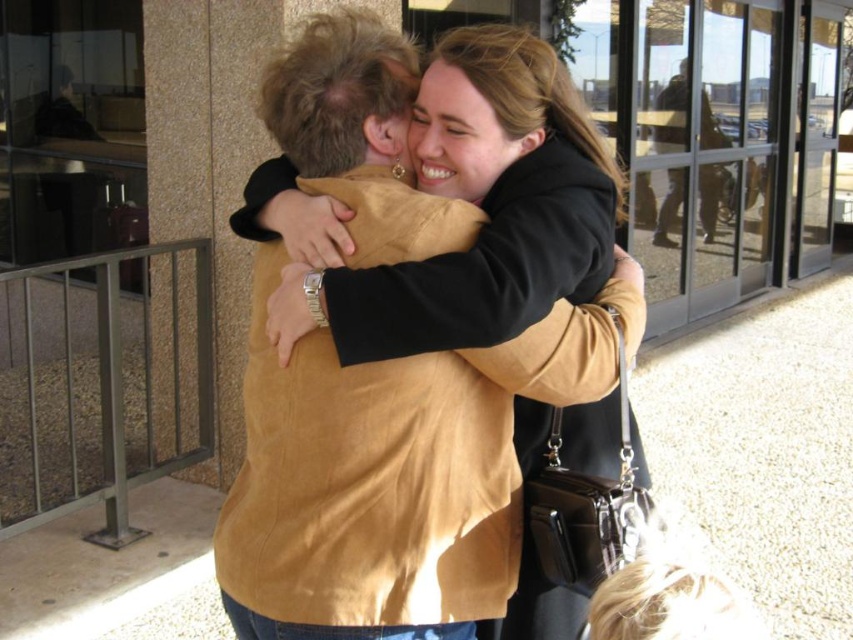
Is matte brown jacket at center shorter than brown suede jacket at upper right?

Correct, matte brown jacket at center is not as tall as brown suede jacket at upper right.

Is matte brown jacket at center to the left of brown suede jacket at upper right from the viewer's perspective?

Correct, you'll find matte brown jacket at center to the left of brown suede jacket at upper right.

Where is `matte brown jacket at center`? matte brown jacket at center is located at coordinates (485, 205).